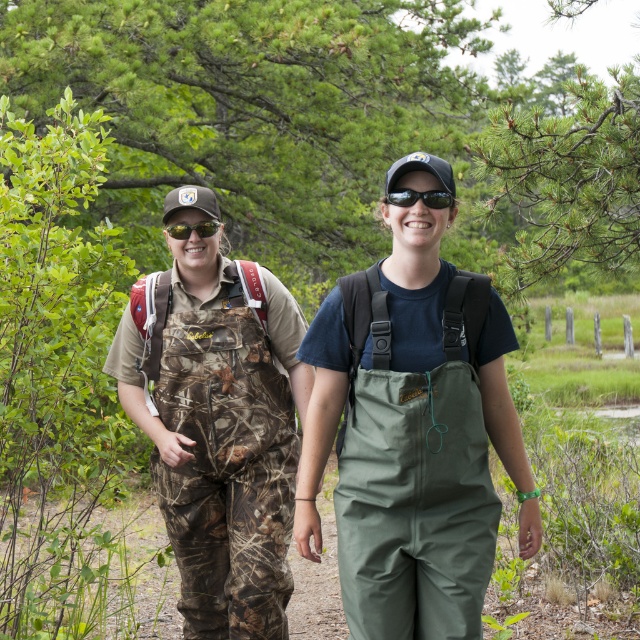
Question: Does camouflage fabric overalls at center have a lesser width compared to black reflective sunglasses at center?

Choices:
 (A) no
 (B) yes

Answer: (A)

Question: Which object is the farthest from the camouflage fabric overalls at center?

Choices:
 (A) black reflective sunglasses at center
 (B) camouflagetextured fabricat left
 (C) matte black goggles at center

Answer: (A)

Question: Can you confirm if black reflective sunglasses at center is positioned below matte black goggles at center?

Choices:
 (A) yes
 (B) no

Answer: (B)

Question: Does camouflage fabric overalls at center have a lesser width compared to black reflective sunglasses at center?

Choices:
 (A) no
 (B) yes

Answer: (A)

Question: Which point appears closest to the camera in this image?

Choices:
 (A) (211, 332)
 (B) (422, 195)

Answer: (B)

Question: Which point is farther to the camera?

Choices:
 (A) (188, 225)
 (B) (426, 193)
 (C) (157, 326)
 (D) (173, 445)

Answer: (C)